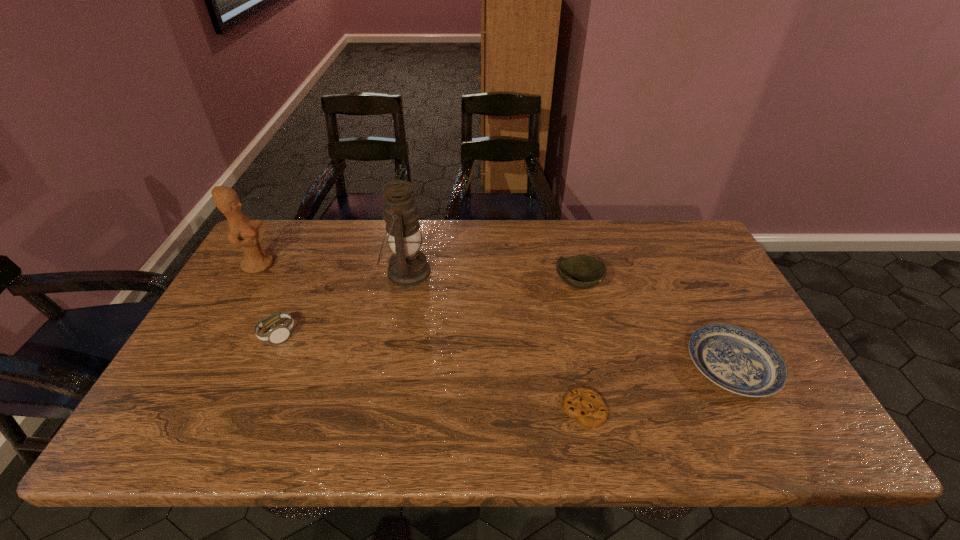
The height and width of the screenshot is (540, 960). I want to click on vacant space located on the face of the watch, so click(x=317, y=334).

Locate an element on the screen. The image size is (960, 540). blank space located 0.330m on the left of the rightmost object is located at coordinates (555, 366).

Find the location of a particular element. vacant region located 0.080m on the left of the shortest object is located at coordinates (527, 410).

The height and width of the screenshot is (540, 960). Identify the location of oil lamp that is at the far edge. (408, 266).

Locate an element on the screen. Image resolution: width=960 pixels, height=540 pixels. figurine that is at the far edge is located at coordinates (243, 232).

You are a GUI agent. You are given a task and a screenshot of the screen. Output one action in this format:
    pyautogui.click(x=<x>, y=<y>)
    Task: Click on the object that is at the near edge
    The width and height of the screenshot is (960, 540).
    Given the screenshot: What is the action you would take?
    pyautogui.click(x=585, y=405)

The image size is (960, 540). I want to click on figurine that is positioned at the left edge, so click(243, 232).

Image resolution: width=960 pixels, height=540 pixels. Find the location of `watch present at the left edge`. watch present at the left edge is located at coordinates (278, 333).

I want to click on object that is at the right edge, so click(736, 359).

Find the location of `object that is at the far left corner`. object that is at the far left corner is located at coordinates (243, 232).